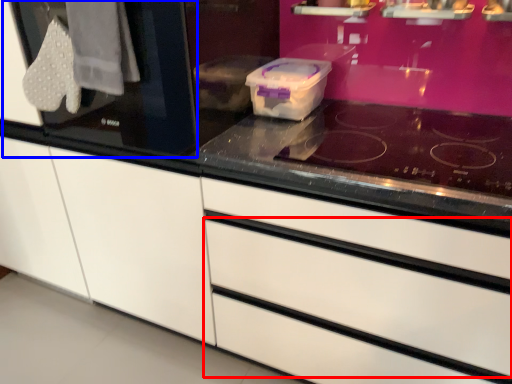
Question: Which object is closer to the camera taking this photo, drawer (highlighted by a red box) or glass door (highlighted by a blue box)?

Choices:
 (A) drawer
 (B) glass door

Answer: (A)